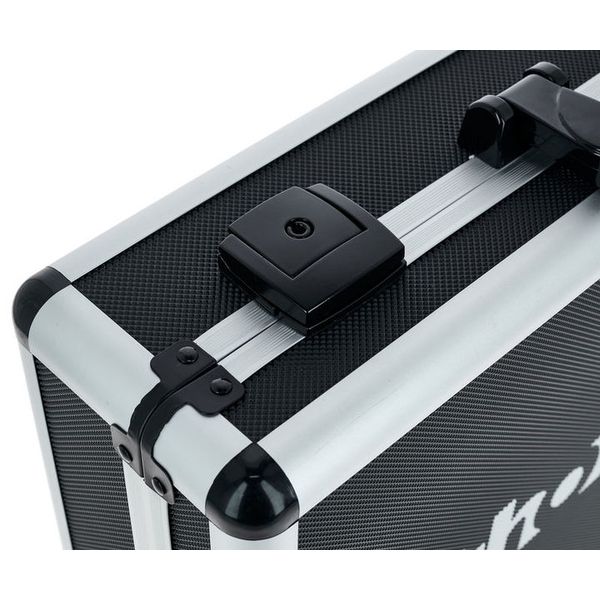
This screenshot has height=600, width=600. I want to click on box, so click(x=453, y=245).